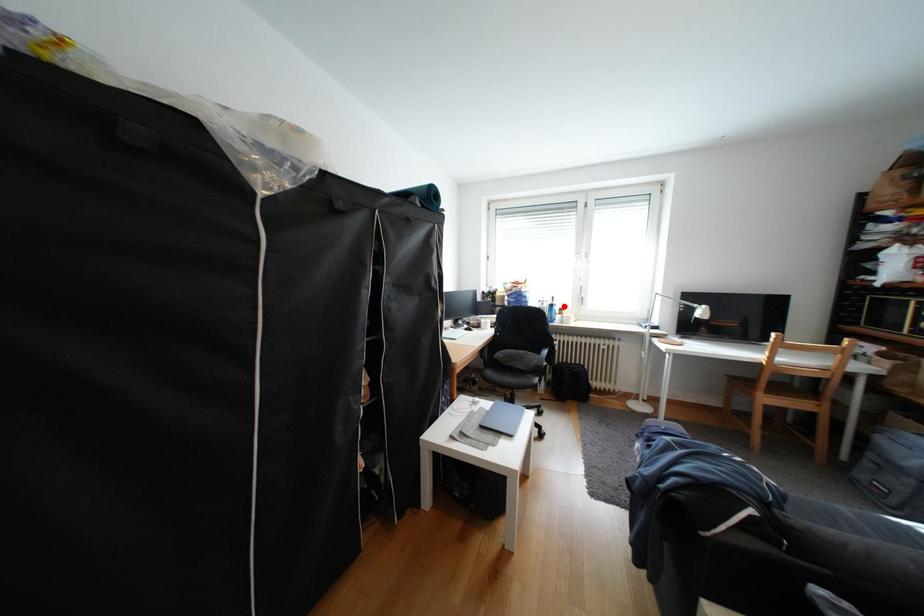
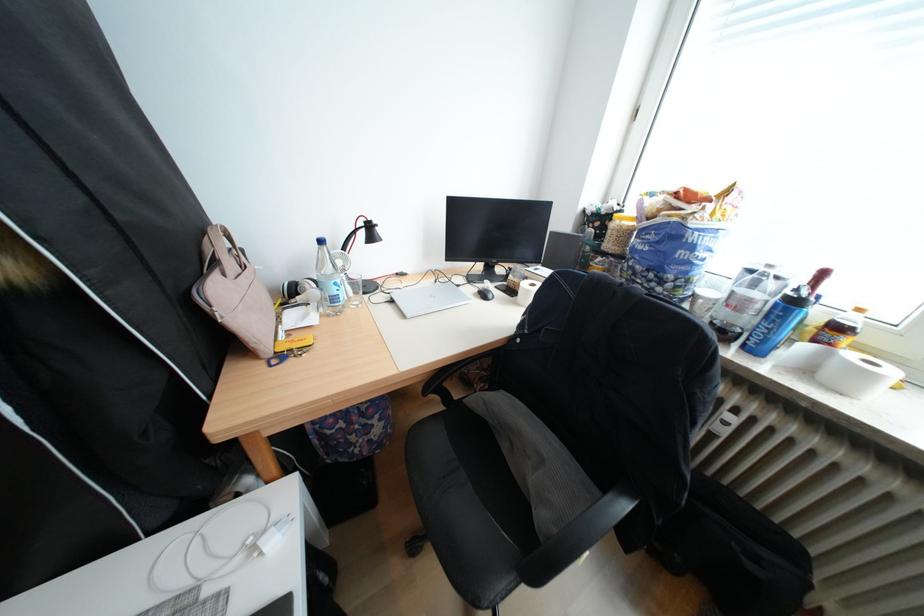
In the second image, find the point that corresponds to the highlighted location in the first image.

(808, 302)